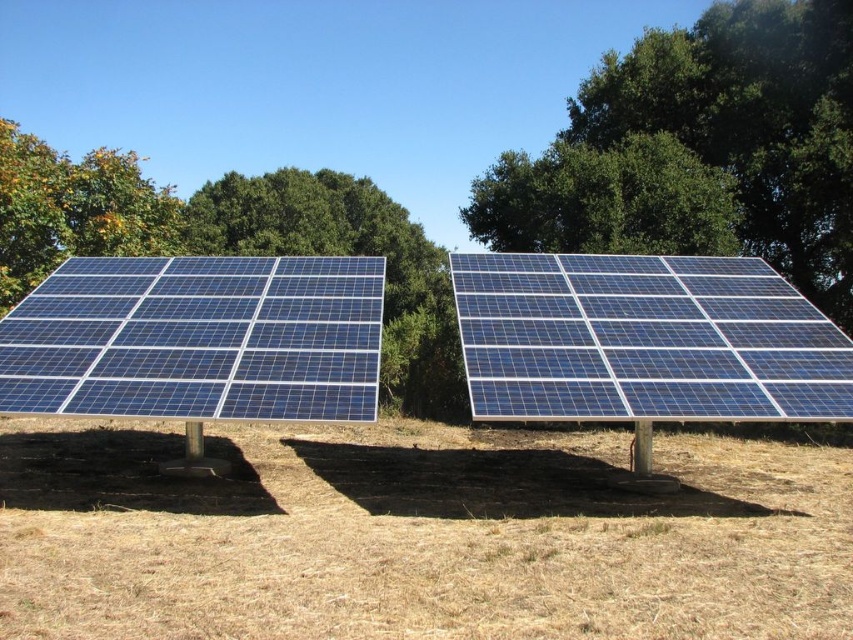
Can you confirm if green leafy tree at center is positioned above green leafy tree at upper left?

No.

Between green leafy tree at center and green leafy tree at upper left, which one is positioned lower?

green leafy tree at center is below.

Which is behind, point (184, 221) or point (140, 220)?

Point (184, 221)

At what (x,y) coordinates should I click in order to perform the action: click on green leafy tree at center. Please return your answer as a coordinate pair (x, y). This screenshot has width=853, height=640. Looking at the image, I should click on pyautogui.click(x=347, y=253).

Can you confirm if brown dry grass at center is positioned to the left of blue glass solar panel at right?

Correct, you'll find brown dry grass at center to the left of blue glass solar panel at right.

Is brown dry grass at center above blue glass solar panel at right?

No.

Does point (804, 486) come closer to viewer compared to point (631, 256)?

Yes.

The image size is (853, 640). What are the coordinates of `brown dry grass at center` in the screenshot? It's located at (416, 536).

Who is more distant from viewer, (454, 492) or (96, 164)?

The point (96, 164) is more distant.

Which is in front, point (409, 609) or point (15, 253)?

Point (409, 609)

Is point (424, 605) in front of point (128, 252)?

That is True.

You are a GUI agent. You are given a task and a screenshot of the screen. Output one action in this format:
    pyautogui.click(x=<x>, y=<y>)
    Task: Click on the brown dry grass at center
    Image resolution: width=853 pixels, height=640 pixels.
    Given the screenshot: What is the action you would take?
    pyautogui.click(x=416, y=536)